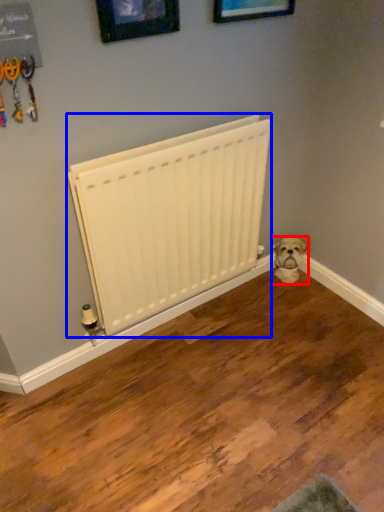
Question: Among these objects, which one is farthest to the camera, dog (highlighted by a red box) or radiator (highlighted by a blue box)?

Choices:
 (A) dog
 (B) radiator

Answer: (A)